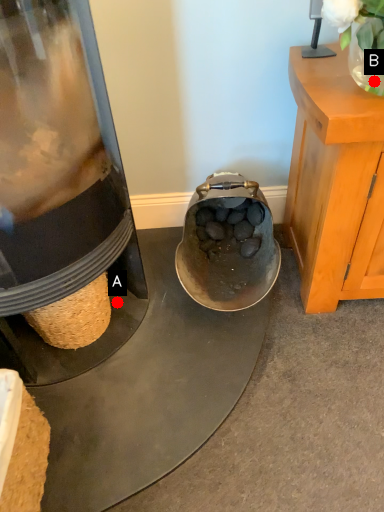
Question: Two points are circled on the image, labeled by A and B beside each circle. Which of the following is the farthest from the observer?

Choices:
 (A) A is further
 (B) B is further

Answer: (A)